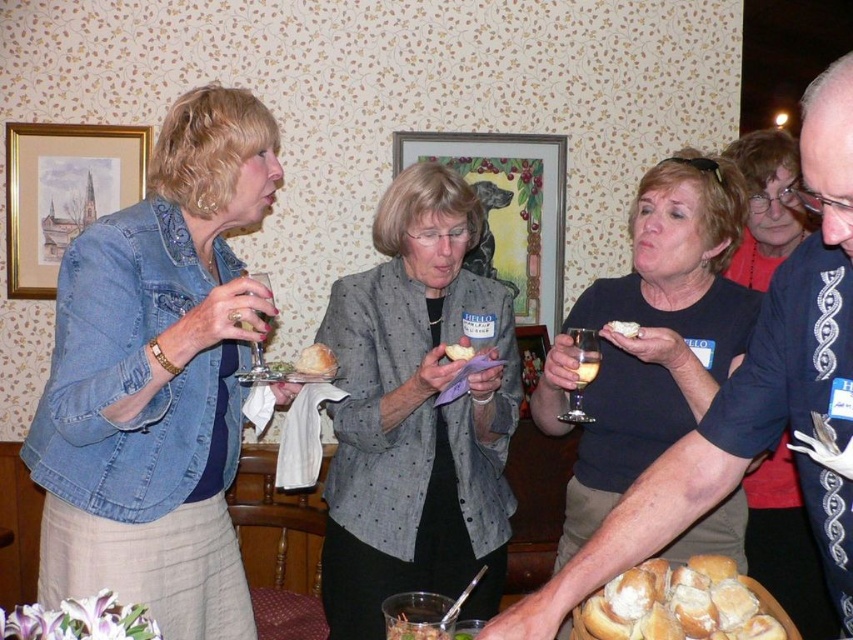
Find the location of `white fluffy bread at lower center`. white fluffy bread at lower center is located at coordinates (682, 604).

Is white fluffy bread at lower center below white crumbly bread at center?

Indeed, white fluffy bread at lower center is positioned under white crumbly bread at center.

Who is more forward, (635, 573) or (456, 355)?

Point (635, 573)

This screenshot has width=853, height=640. In order to click on white fluffy bread at lower center in this screenshot , I will do `click(682, 604)`.

Where is `matte black shirt at center`? Image resolution: width=853 pixels, height=640 pixels. matte black shirt at center is located at coordinates (785, 545).

What do you see at coordinates (785, 545) in the screenshot? I see `matte black shirt at center` at bounding box center [785, 545].

Where is `matte black shirt at center`? This screenshot has height=640, width=853. matte black shirt at center is located at coordinates (785, 545).

Which is behind, point (254, 276) or point (608, 324)?

The point (608, 324) is behind.

Who is taller, clear glass wine glass at upper left or white bread at center?

With more height is clear glass wine glass at upper left.

Who is more distant from viewer, (253, 348) or (613, 332)?

Positioned behind is point (613, 332).

At what (x,y) coordinates should I click in order to perform the action: click on clear glass wine glass at upper left. Please return your answer as a coordinate pair (x, y). Looking at the image, I should click on (259, 368).